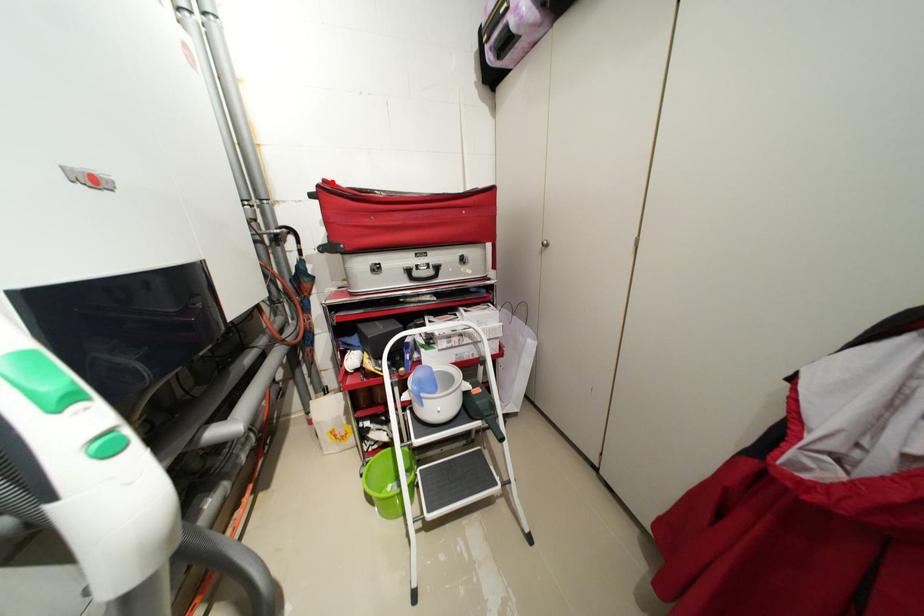
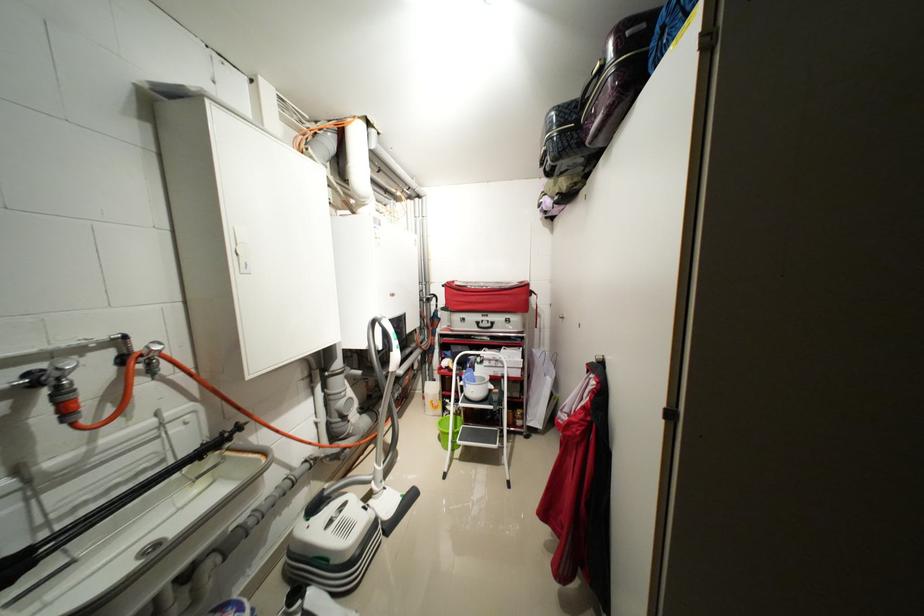
Question: I am providing you with two images of the same scene from different viewpoints. A red point is marked on the first image. At the location where the point appears in image 1, is it still visible in image 2?

Choices:
 (A) Yes
 (B) No

Answer: (A)